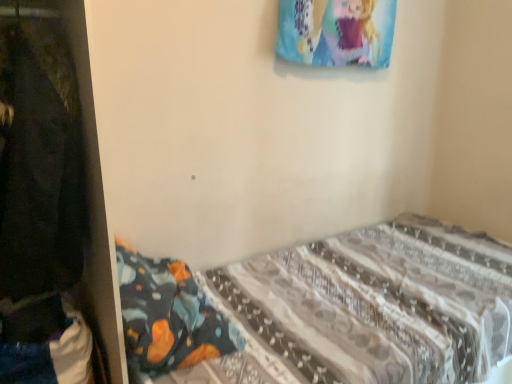
Question: Is patterned fabric bed at lower right inside black fabric at left?

Choices:
 (A) yes
 (B) no

Answer: (B)

Question: Is black fabric at left not inside patterned fabric bed at lower right?

Choices:
 (A) no
 (B) yes

Answer: (B)

Question: From a real-world perspective, does black fabric at left sit lower than patterned fabric bed at lower right?

Choices:
 (A) no
 (B) yes

Answer: (A)

Question: Does black fabric at left have a lesser width compared to patterned fabric bed at lower right?

Choices:
 (A) no
 (B) yes

Answer: (B)

Question: Does black fabric at left have a lesser height compared to patterned fabric bed at lower right?

Choices:
 (A) no
 (B) yes

Answer: (A)

Question: Is black fabric at left closer to camera compared to patterned fabric bed at lower right?

Choices:
 (A) no
 (B) yes

Answer: (B)

Question: Could you tell me if patterned fabric bed at lower right is facing black fabric at left?

Choices:
 (A) yes
 (B) no

Answer: (B)

Question: Is the depth of patterned fabric bed at lower right greater than that of black fabric at left?

Choices:
 (A) yes
 (B) no

Answer: (A)

Question: From a real-world perspective, does patterned fabric bed at lower right stand above black fabric at left?

Choices:
 (A) yes
 (B) no

Answer: (B)

Question: From the image's perspective, is patterned fabric bed at lower right on black fabric at left?

Choices:
 (A) yes
 (B) no

Answer: (B)

Question: From the image's perspective, is patterned fabric bed at lower right beneath black fabric at left?

Choices:
 (A) no
 (B) yes

Answer: (B)

Question: Does patterned fabric bed at lower right have a greater height compared to black fabric at left?

Choices:
 (A) no
 (B) yes

Answer: (A)

Question: In terms of width, does black fabric at left look wider or thinner when compared to patterned fabric bed at lower right?

Choices:
 (A) wide
 (B) thin

Answer: (B)